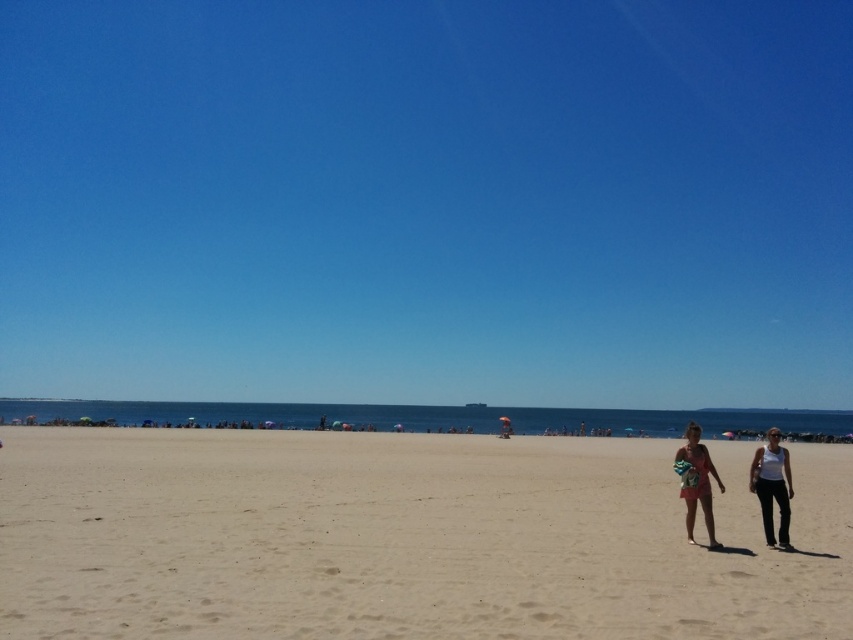
Question: Can you confirm if white cotton tank top at lower right is wider than beige cotton dress at lower right?

Choices:
 (A) no
 (B) yes

Answer: (B)

Question: Does white cotton tank top at lower right appear under beige cotton dress at lower right?

Choices:
 (A) yes
 (B) no

Answer: (A)

Question: Among these objects, which one is farthest from the camera?

Choices:
 (A) white cotton tank top at lower right
 (B) beige cotton dress at lower right
 (C) blue sky at upper center
 (D) beige sand at center

Answer: (C)

Question: Among these objects, which one is nearest to the camera?

Choices:
 (A) white cotton tank top at lower right
 (B) beige sand at center

Answer: (B)

Question: Among these objects, which one is farthest from the camera?

Choices:
 (A) beige sand at center
 (B) white cotton tank top at lower right
 (C) blue sky at upper center
 (D) beige cotton dress at lower right

Answer: (C)

Question: Is beige sand at center positioned at the back of beige cotton dress at lower right?

Choices:
 (A) yes
 (B) no

Answer: (B)